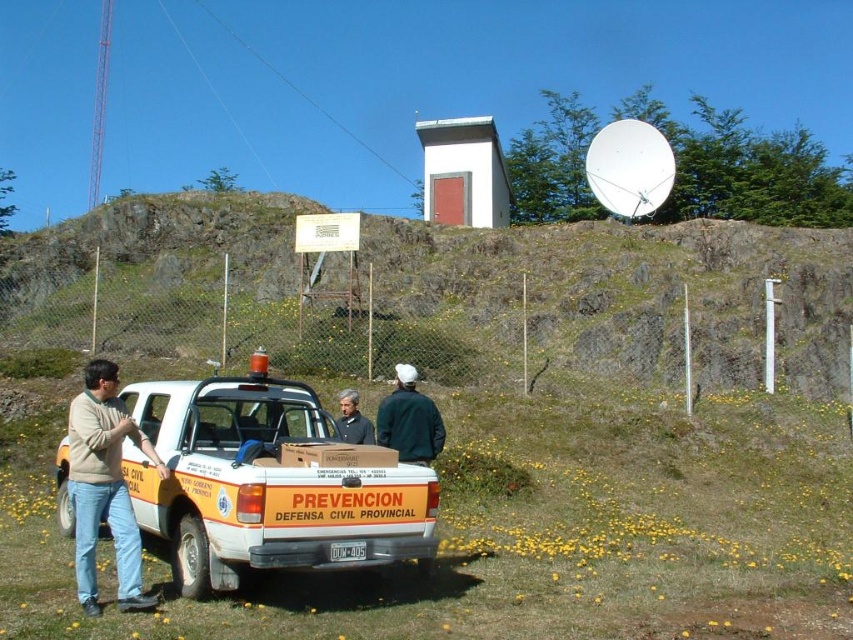
Question: Which object appears farthest from the camera in this image?

Choices:
 (A) white matte pickup truck at center
 (B) dark green fabric jacket at center
 (C) rocky terrain at upper center
 (D) light brown sweater at left

Answer: (C)

Question: Estimate the real-world distances between objects in this image. Which object is farther from the rocky terrain at upper center?

Choices:
 (A) white matte pickup truck at center
 (B) gray fabric jacket at center

Answer: (A)

Question: Does white matte pickup truck at center appear on the right side of light brown sweater at left?

Choices:
 (A) no
 (B) yes

Answer: (B)

Question: Which of the following is the farthest from the observer?

Choices:
 (A) pyautogui.click(x=349, y=401)
 (B) pyautogui.click(x=99, y=513)

Answer: (A)

Question: Does rocky terrain at upper center come in front of white matte pickup truck at center?

Choices:
 (A) no
 (B) yes

Answer: (A)

Question: Is white matte pickup truck at center thinner than dark green fabric jacket at center?

Choices:
 (A) yes
 (B) no

Answer: (B)